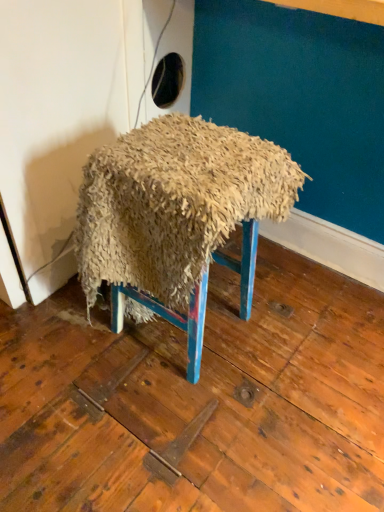
The image size is (384, 512). What do you see at coordinates (177, 217) in the screenshot?
I see `fuzzy straw stool at center` at bounding box center [177, 217].

Measure the distance between fuzzy straw stool at center and camera.

The depth of fuzzy straw stool at center is 38.86 inches.

Locate an element on the screen. fuzzy straw stool at center is located at coordinates click(177, 217).

The width and height of the screenshot is (384, 512). What are the coordinates of `fuzzy straw stool at center` in the screenshot? It's located at (177, 217).